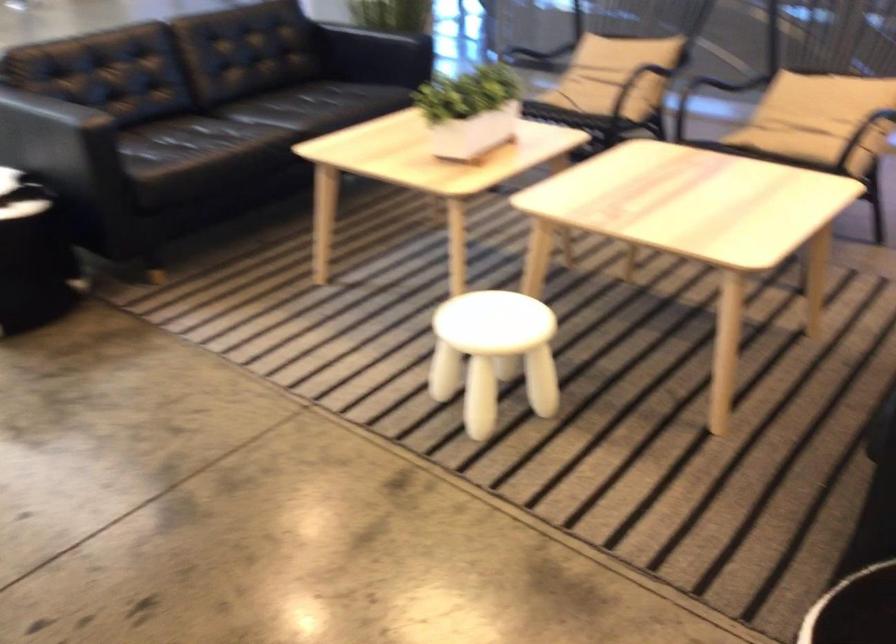
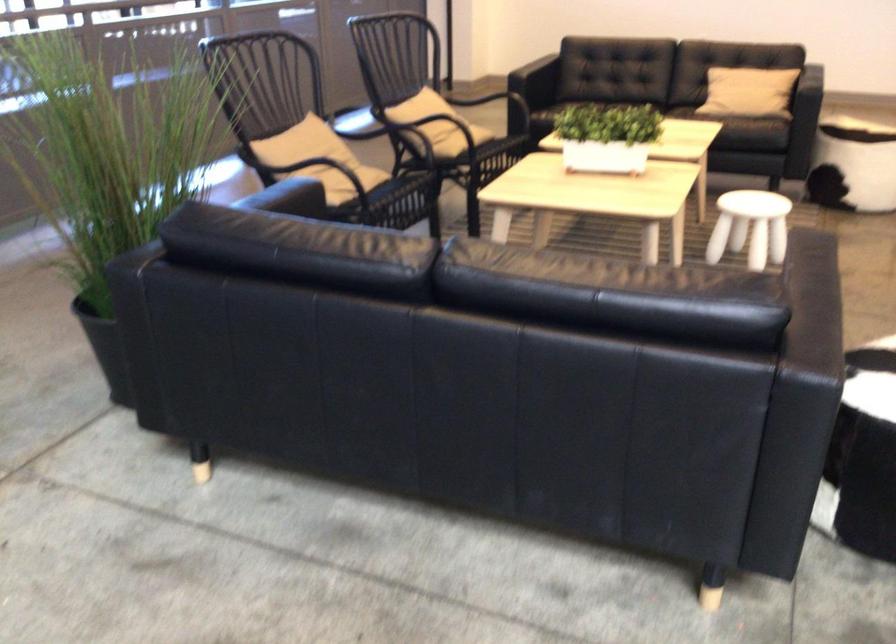
Question: I am providing you with two images of the same scene from different viewpoints. After the viewpoint changes to image2, which objects are now occluded?

Choices:
 (A) white stool
 (B) black router
 (C) beige throw pillow
 (D) black chair armrest

Answer: (A)